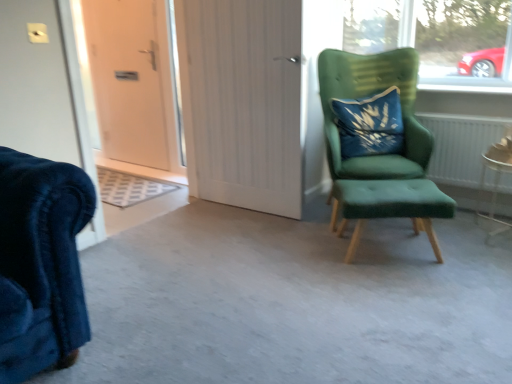
In order to face white wood door at center, marked as the 2th door in a back-to-front arrangement, should I rotate leftwards or rightwards?

A 1.780 degree turn to the left will do.

This screenshot has height=384, width=512. Describe the element at coordinates (460, 145) in the screenshot. I see `white textured radiator at right` at that location.

Image resolution: width=512 pixels, height=384 pixels. Describe the element at coordinates (370, 124) in the screenshot. I see `blue velvet pillow at upper right` at that location.

In order to face white matte door at left, the second door from the right, should I rotate leftwards or rightwards?

Turn left approximately 17.359 degrees to face it.

Find the location of a particular element. white wood door at center, which ranks as the first door in right-to-left order is located at coordinates click(x=242, y=101).

Is transparent glass door at upper left bigger than metallic silver side table at lower right?

Incorrect, transparent glass door at upper left is not larger than metallic silver side table at lower right.

From a real-world perspective, is transparent glass door at upper left located beneath metallic silver side table at lower right?

No, from a real-world perspective, transparent glass door at upper left is not below metallic silver side table at lower right.

Is transparent glass door at upper left far away from metallic silver side table at lower right?

Yes.

Is metallic silver side table at lower right completely or partially inside transparent glass door at upper left?

No, metallic silver side table at lower right is not inside transparent glass door at upper left.

Based on the photo, between white textured radiator at right and metallic silver side table at lower right, which one has smaller size?

With smaller size is metallic silver side table at lower right.

The height and width of the screenshot is (384, 512). In order to click on side table in front of the white textured radiator at right in this screenshot , I will do `click(495, 180)`.

Does white textured radiator at right have a greater width compared to metallic silver side table at lower right?

In fact, white textured radiator at right might be narrower than metallic silver side table at lower right.

Where is `pillow behind the green fabric chair at right`? pillow behind the green fabric chair at right is located at coordinates 370,124.

Considering their positions, is blue velvet pillow at upper right located in front of or behind green fabric chair at right?

blue velvet pillow at upper right is behind green fabric chair at right.

Is blue velvet pillow at upper right at the right side of green fabric chair at right?

No.

Does blue velvet pillow at upper right contain green fabric chair at right?

No, green fabric chair at right is not inside blue velvet pillow at upper right.

Is green fabric stool at right positioned far away from white wood door at center, marked as the 2th door in a back-to-front arrangement?

No.

Which is in front, point (352, 245) or point (271, 20)?

The point (352, 245) is in front.

Who is shorter, green fabric stool at right or white wood door at center, acting as the 1th door starting from the front?

green fabric stool at right.

Could you tell me if green fabric stool at right is turned towards white wood door at center, marked as the 2th door in a back-to-front arrangement?

No, green fabric stool at right is not turned towards white wood door at center, marked as the 2th door in a back-to-front arrangement.

Is green fabric stool at right next to blue velvet pillow at upper right and touching it?

green fabric stool at right and blue velvet pillow at upper right are clearly separated.

Looking at this image, is green fabric stool at right wider or thinner than blue velvet pillow at upper right?

Considering their sizes, green fabric stool at right looks broader than blue velvet pillow at upper right.

Is green fabric stool at right not within blue velvet pillow at upper right?

green fabric stool at right lies outside blue velvet pillow at upper right's area.

From the image's perspective, between green fabric stool at right and blue velvet pillow at upper right, which one is located above?

From the image's view, blue velvet pillow at upper right is above.

Which is correct: metallic silver side table at lower right is inside blue velvet pillow at upper right, or outside of it?

metallic silver side table at lower right is not inside blue velvet pillow at upper right, it's outside.

From the image's perspective, which object appears higher, metallic silver side table at lower right or blue velvet pillow at upper right?

blue velvet pillow at upper right is shown above in the image.

Consider the image. Is metallic silver side table at lower right looking in the opposite direction of blue velvet pillow at upper right?

No.

Based on their sizes in the image, would you say metallic silver side table at lower right is bigger or smaller than blue velvet pillow at upper right?

Considering their sizes, metallic silver side table at lower right takes up less space than blue velvet pillow at upper right.

Is white textured radiator at right inside or outside of green fabric chair at right?

white textured radiator at right is not enclosed by green fabric chair at right.

How many degrees apart are the facing directions of white textured radiator at right and green fabric chair at right?

They differ by 35.8 degrees in their facing directions.

Does white textured radiator at right turn towards green fabric chair at right?

Yes, white textured radiator at right is oriented towards green fabric chair at right.

From a real-world perspective, does white textured radiator at right stand above green fabric chair at right?

No.

The height and width of the screenshot is (384, 512). Identify the location of side table directly beneath the transparent glass door at upper left (from a real-world perspective). (495, 180).

Where is `side table on the right of white textured radiator at right`? side table on the right of white textured radiator at right is located at coordinates click(x=495, y=180).

Estimate the real-world distances between objects in this image. Which object is further from white textured radiator at right, white matte door at left, the second door from the right, or green fabric chair at right?

The object further to white textured radiator at right is white matte door at left, the second door from the right.

When comparing their distances from white textured radiator at right, does metallic silver side table at lower right or green fabric stool at right seem closer?

metallic silver side table at lower right is closer to white textured radiator at right.

Which object lies further to the anchor point white matte door at left, the second door from the right, green fabric stool at right or white textured radiator at right?

The object further to white matte door at left, the second door from the right, is white textured radiator at right.

From the image, which object appears to be farther from white matte door at left, the 1th door in the back-to-front sequence, blue velvet pillow at upper right or green fabric stool at right?

Among the two, green fabric stool at right is located further to white matte door at left, the 1th door in the back-to-front sequence.

Considering their positions, is white matte door at left, placed as the second door when sorted from front to back, positioned further to blue velvet pillow at upper right than green fabric chair at right?

white matte door at left, placed as the second door when sorted from front to back, is positioned further to the anchor blue velvet pillow at upper right.

When comparing their distances from white wood door at center, which ranks as the first door in right-to-left order, does transparent glass door at upper left or blue velvet pillow at upper right seem further?

Among the two, blue velvet pillow at upper right is located further to white wood door at center, which ranks as the first door in right-to-left order.

Based on the photo, from the image, which object appears to be farther from green fabric stool at right, transparent glass door at upper left or white matte door at left, placed as the second door when sorted from front to back?

white matte door at left, placed as the second door when sorted from front to back.

From the picture: From the image, which object appears to be nearer to white wood door at center, acting as the 1th door starting from the front, white matte door at left, the 1th door in the back-to-front sequence, or blue velvet pillow at upper right?

blue velvet pillow at upper right is positioned closer to the anchor white wood door at center, acting as the 1th door starting from the front.

At what (x,y) coordinates should I click in order to perform the action: click on window screen between white matte door at left, the 1th door in the back-to-front sequence, and blue velvet pillow at upper right. Please return your answer as a coordinate pair (x, y). This screenshot has height=384, width=512. Looking at the image, I should click on (176, 80).

Locate an element on the screen. The image size is (512, 384). door located between white matte door at left, the second door from the right, and white textured radiator at right in the left-right direction is located at coordinates (242, 101).

Find the location of `stool between white wood door at center, which ranks as the first door in right-to-left order, and metallic silver side table at lower right, in the horizontal direction`. stool between white wood door at center, which ranks as the first door in right-to-left order, and metallic silver side table at lower right, in the horizontal direction is located at coordinates (389, 206).

Locate an element on the screen. The width and height of the screenshot is (512, 384). pillow between transparent glass door at upper left and metallic silver side table at lower right in the horizontal direction is located at coordinates (370, 124).